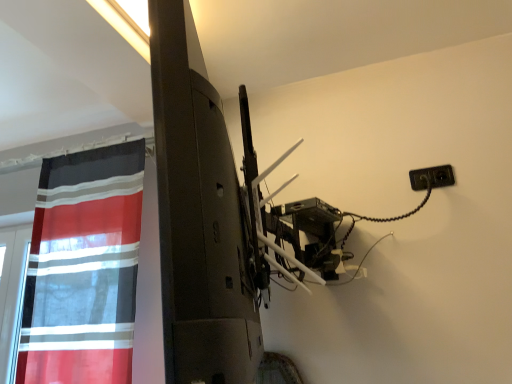
Question: From a real-world perspective, does red sheer curtain at left stand above black plastic outlet at upper right?

Choices:
 (A) yes
 (B) no

Answer: (B)

Question: Does red sheer curtain at left have a lesser width compared to black plastic outlet at upper right?

Choices:
 (A) yes
 (B) no

Answer: (B)

Question: Can you confirm if red sheer curtain at left is bigger than black plastic outlet at upper right?

Choices:
 (A) no
 (B) yes

Answer: (B)

Question: Does red sheer curtain at left appear on the left side of black plastic outlet at upper right?

Choices:
 (A) no
 (B) yes

Answer: (B)

Question: Is red sheer curtain at left located outside black plastic outlet at upper right?

Choices:
 (A) no
 (B) yes

Answer: (B)

Question: Is red sheer curtain at left with black plastic outlet at upper right?

Choices:
 (A) no
 (B) yes

Answer: (A)

Question: From a real-world perspective, does black plastic outlet at upper right sit lower than red sheer curtain at left?

Choices:
 (A) yes
 (B) no

Answer: (B)

Question: Is red sheer curtain at left at the back of black plastic outlet at upper right?

Choices:
 (A) yes
 (B) no

Answer: (B)

Question: Can you confirm if black plastic outlet at upper right is wider than red sheer curtain at left?

Choices:
 (A) yes
 (B) no

Answer: (B)

Question: Considering the relative sizes of black plastic outlet at upper right and red sheer curtain at left in the image provided, is black plastic outlet at upper right shorter than red sheer curtain at left?

Choices:
 (A) no
 (B) yes

Answer: (B)

Question: Is black plastic outlet at upper right thinner than red sheer curtain at left?

Choices:
 (A) yes
 (B) no

Answer: (A)

Question: Is black plastic outlet at upper right not close to red sheer curtain at left?

Choices:
 (A) no
 (B) yes

Answer: (B)

Question: Is red sheer curtain at left in front of or behind black plastic outlet at upper right in the image?

Choices:
 (A) front
 (B) behind

Answer: (A)